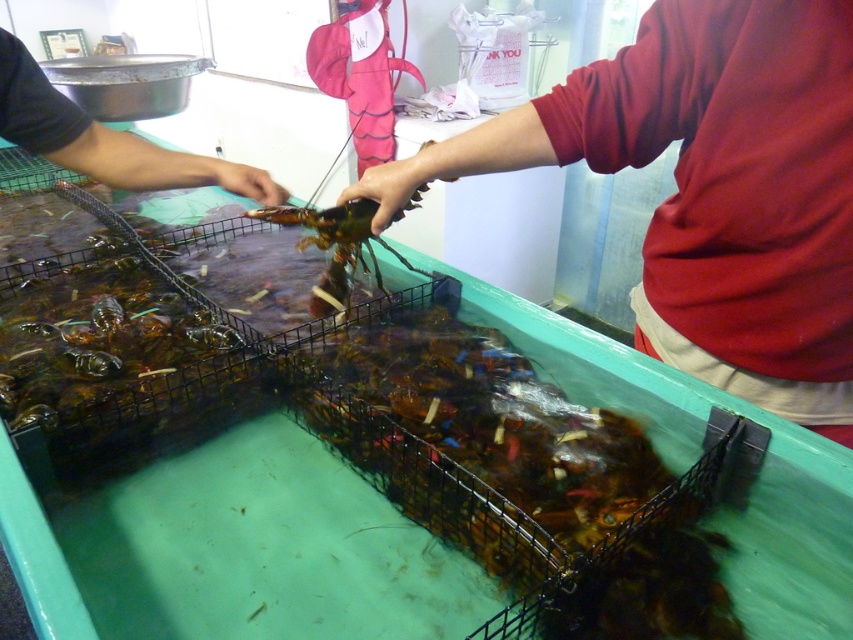
Question: Which point is farther to the camera?

Choices:
 (A) black matte hand at upper left
 (B) matte red shirt at center

Answer: (A)

Question: Can you confirm if matte red shirt at center is positioned above black matte hand at upper left?

Choices:
 (A) no
 (B) yes

Answer: (A)

Question: Is matte red shirt at center positioned behind black matte hand at upper left?

Choices:
 (A) no
 (B) yes

Answer: (A)

Question: Which point appears farthest from the camera in this image?

Choices:
 (A) (816, 419)
 (B) (21, 68)

Answer: (B)

Question: Is matte red shirt at center smaller than black matte hand at upper left?

Choices:
 (A) yes
 (B) no

Answer: (B)

Question: Which of the following is the closest to the observer?

Choices:
 (A) black matte hand at upper left
 (B) matte red shirt at center

Answer: (B)